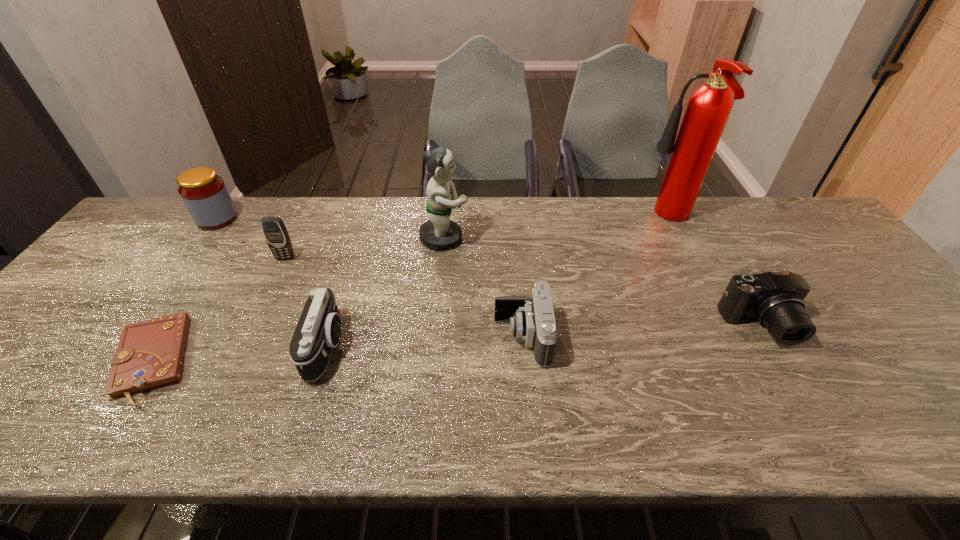
At what (x,y) coordinates should I click in order to perform the action: click on fire extinguisher. Please return your answer as a coordinate pair (x, y). Looking at the image, I should click on (708, 108).

Where is `the fourth object from right to left`? Image resolution: width=960 pixels, height=540 pixels. the fourth object from right to left is located at coordinates (439, 233).

I want to click on figurine, so click(x=439, y=233).

You are a GUI agent. You are given a task and a screenshot of the screen. Output one action in this format:
    pyautogui.click(x=<x>, y=<y>)
    Task: Click on the jar
    
    Given the screenshot: What is the action you would take?
    pyautogui.click(x=205, y=195)

The width and height of the screenshot is (960, 540). What are the coordinates of `cellular telephone` in the screenshot? It's located at (274, 230).

You are a GUI agent. You are given a task and a screenshot of the screen. Output one action in this format:
    pyautogui.click(x=<x>, y=<y>)
    Task: Click on the fourth farthest object
    The image size is (960, 540).
    Given the screenshot: What is the action you would take?
    pyautogui.click(x=274, y=230)

Identify the location of the leftmost camera. (318, 330).

The image size is (960, 540). I want to click on the rightmost camera, so click(775, 298).

Locate an element on the screen. The image size is (960, 540). the second camera from left to right is located at coordinates (533, 320).

The image size is (960, 540). I want to click on the shortest object, so click(149, 355).